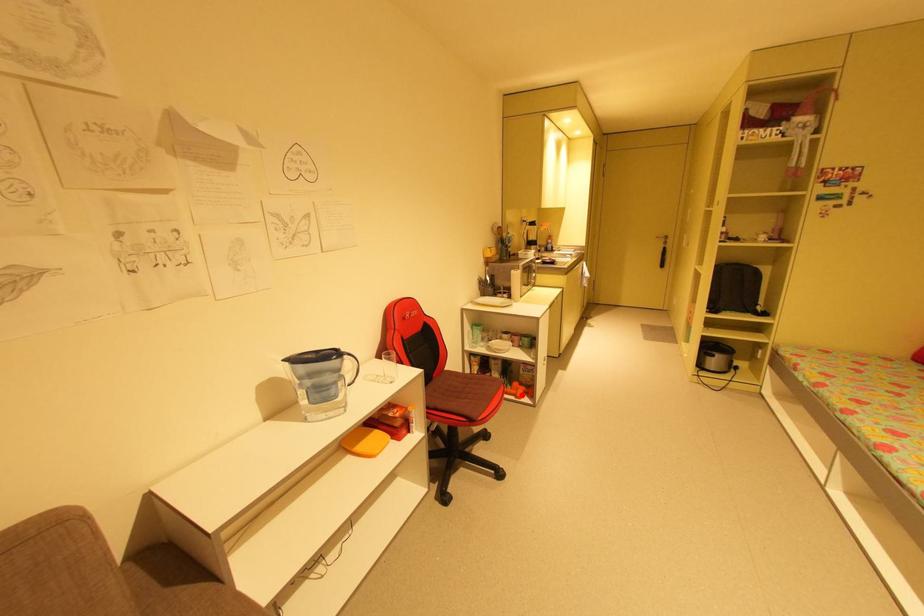
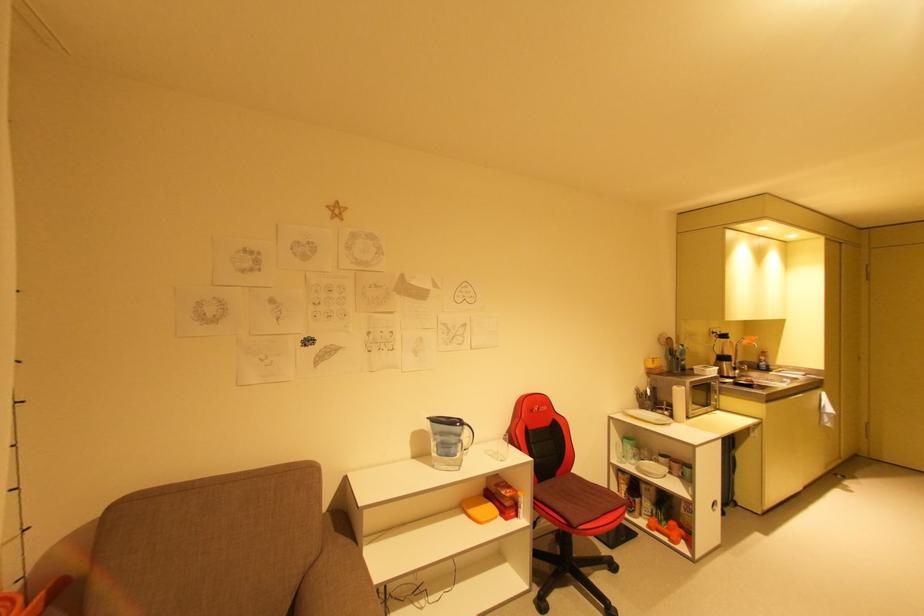
Where in the second image is the point corresponding to the highlighted location from the first image?

(675, 538)